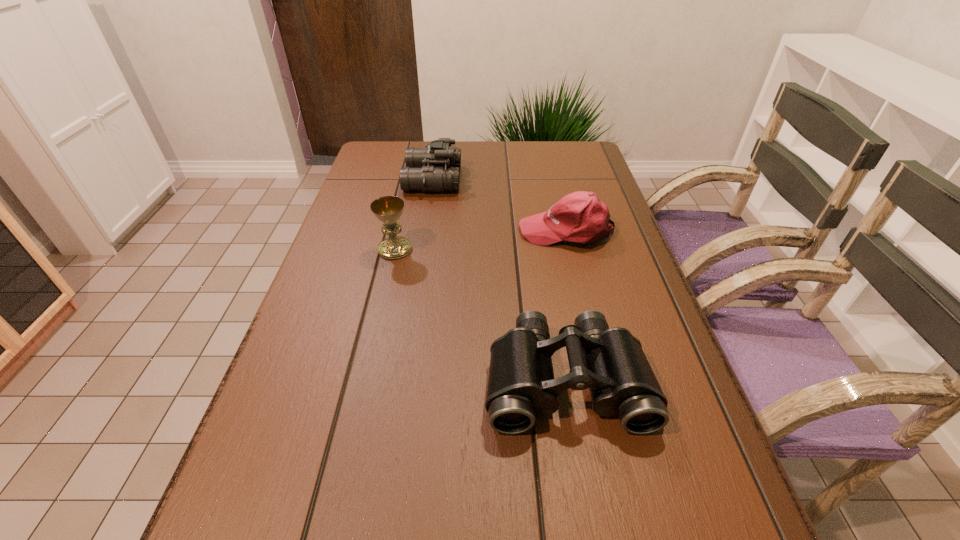
At what (x,y) coordinates should I click in order to perform the action: click on chalice. Please return your answer as a coordinate pair (x, y). The image size is (960, 540). Looking at the image, I should click on (388, 209).

Image resolution: width=960 pixels, height=540 pixels. Find the location of `the farther binoculars`. the farther binoculars is located at coordinates (435, 168).

Image resolution: width=960 pixels, height=540 pixels. I want to click on the left binoculars, so click(x=435, y=168).

At what (x,y) coordinates should I click in order to perform the action: click on the right binoculars. Please return your answer as a coordinate pair (x, y). This screenshot has height=540, width=960. Looking at the image, I should click on (610, 362).

Find the location of a particular element. This screenshot has width=960, height=540. the nearest object is located at coordinates (610, 362).

Where is `baseball cap`? baseball cap is located at coordinates (580, 217).

The height and width of the screenshot is (540, 960). I want to click on free space located 0.360m on the back of the chalice, so click(413, 170).

Locate an element on the screen. This screenshot has height=540, width=960. blank space located through the lenses of the left binoculars is located at coordinates (477, 179).

Image resolution: width=960 pixels, height=540 pixels. Identify the location of vacant space located 0.060m on the front-facing side of the nearest object. (582, 472).

Find the location of a particular element. The image size is (960, 540). vacant space located at the front of the baseball cap with the brim is located at coordinates (442, 231).